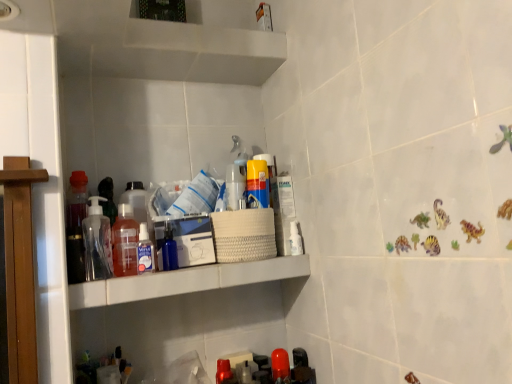
At what (x,y) coordinates should I click in order to perform the action: click on vacant space that's between white plastic bottle at upper right, the 3th toiletry viewed from the front, and translucent plastic pump bottle at left, the 2th bottle viewed from the left. Please return your answer as a coordinate pair (x, y). The width and height of the screenshot is (512, 384). Looking at the image, I should click on click(204, 267).